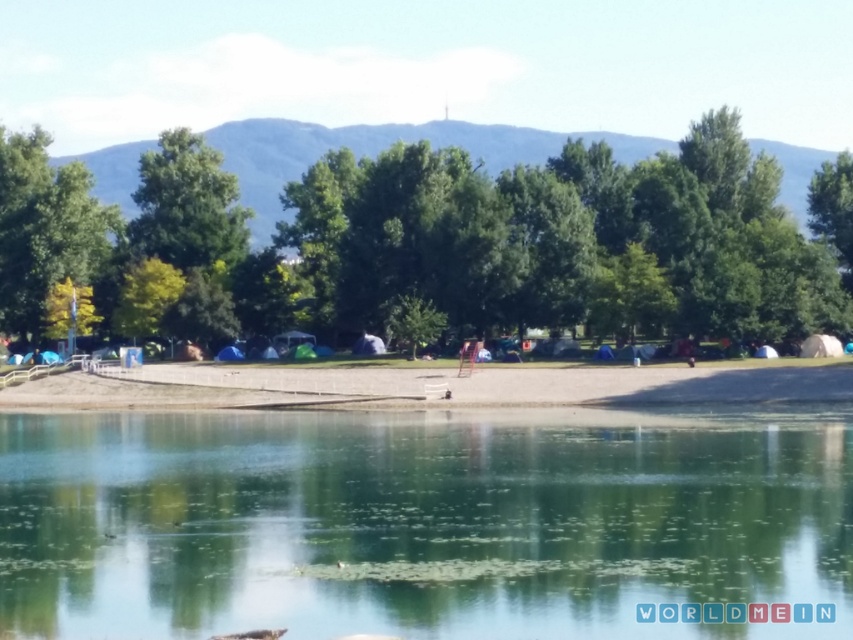
Is brown sand at center positioned at the back of green leafy tree at left?

No.

Between point (129, 376) and point (86, 173), which one is positioned in front?

Point (129, 376) is more forward.

Locate an element on the screen. This screenshot has width=853, height=640. brown sand at center is located at coordinates (433, 384).

Can you confirm if green leafy tree at center is wider than brown sand at center?

Correct, the width of green leafy tree at center exceeds that of brown sand at center.

Is the position of green leafy tree at center less distant than that of brown sand at center?

No, it is behind brown sand at center.

This screenshot has width=853, height=640. What do you see at coordinates (442, 241) in the screenshot?
I see `green leafy tree at center` at bounding box center [442, 241].

The width and height of the screenshot is (853, 640). Find the location of `green leafy tree at center`. green leafy tree at center is located at coordinates (442, 241).

Between point (788, 452) and point (113, 387), which one is positioned behind?

Point (113, 387)

Which is more to the right, clear water at center or brown sand at center?

Positioned to the right is clear water at center.

Is point (709, 547) less distant than point (664, 394)?

Yes, it is.

Identify the location of clear water at center. The image size is (853, 640). (415, 524).